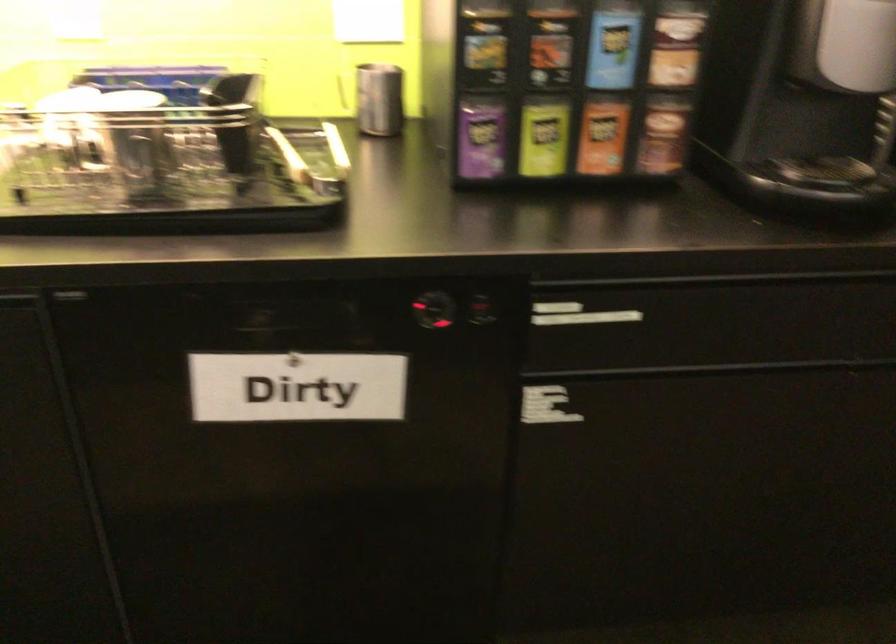
This screenshot has height=644, width=896. Describe the element at coordinates (578, 315) in the screenshot. I see `the black drawer handle` at that location.